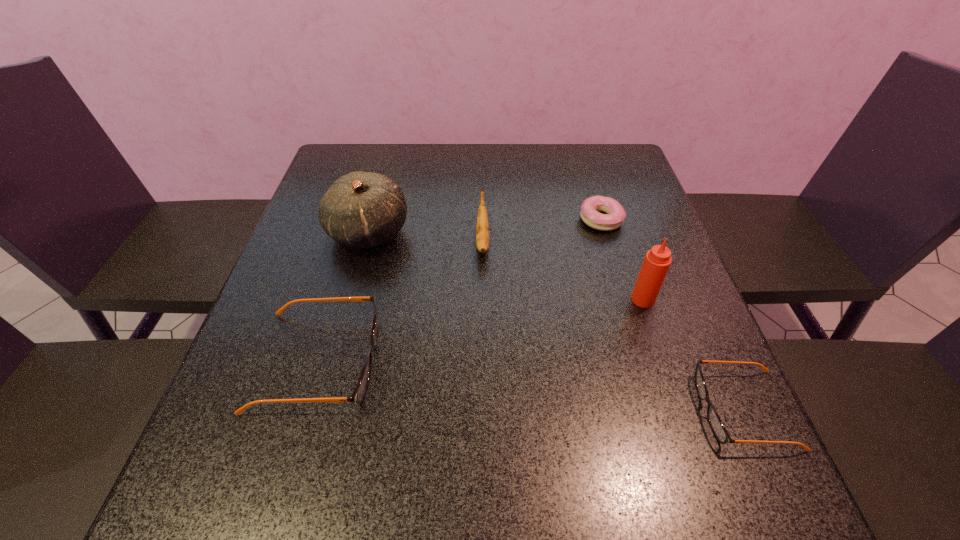
You are a GUI agent. You are given a task and a screenshot of the screen. Output one action in this format:
    pyautogui.click(x=<x>, y=<y>)
    Task: Click on the vacant spot for a new spectacles to ensure equal spacing
    Image resolution: width=960 pixels, height=540 pixels.
    Given the screenshot: What is the action you would take?
    pyautogui.click(x=522, y=384)